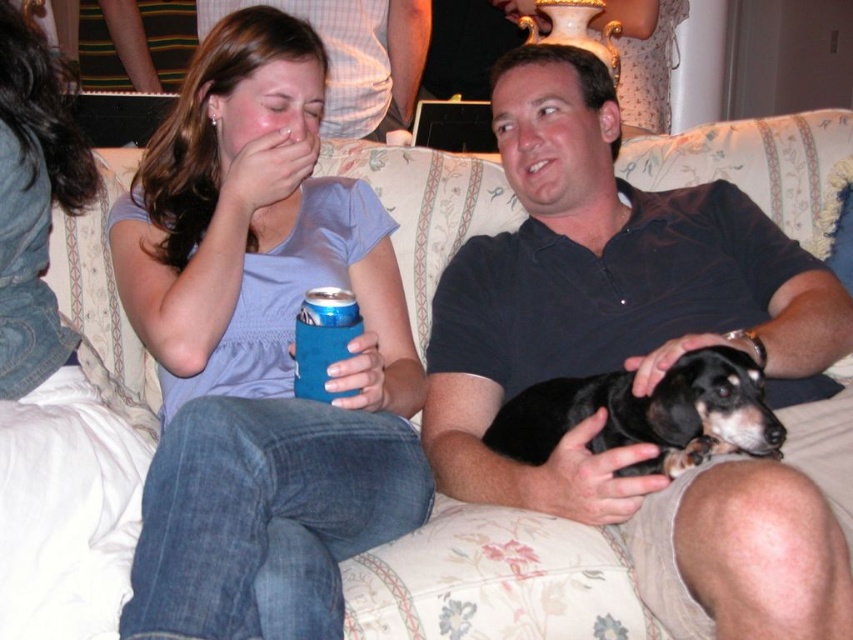
Question: Where is matte blue fabric can cooler at left located in relation to black smooth dog at center in the image?

Choices:
 (A) left
 (B) right

Answer: (A)

Question: Is black smooth shirt at center smaller than matte blue fabric can cooler at left?

Choices:
 (A) no
 (B) yes

Answer: (A)

Question: Does black smooth shirt at center have a larger size compared to black smooth dog at center?

Choices:
 (A) yes
 (B) no

Answer: (A)

Question: Which of the following is the closest to the observer?

Choices:
 (A) pyautogui.click(x=337, y=385)
 (B) pyautogui.click(x=525, y=433)
 (C) pyautogui.click(x=598, y=252)

Answer: (A)

Question: Which of the following is the closest to the observer?

Choices:
 (A) black smooth dog at center
 (B) matte blue fabric can cooler at left

Answer: (B)

Question: Which is farther from the black smooth shirt at center?

Choices:
 (A) matte blue fabric can cooler at left
 (B) black smooth dog at center

Answer: (A)